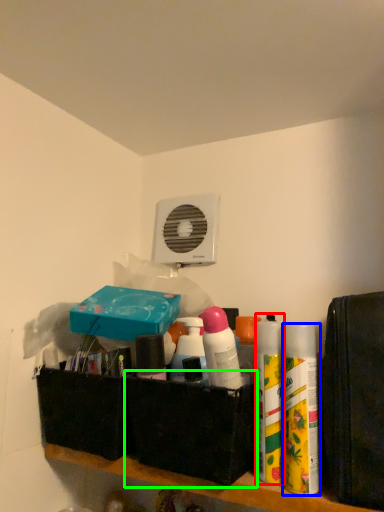
Question: Which object is positioned farthest from cleaning product (highlighted by a red box)? Select from cleaning product (highlighted by a blue box) and box (highlighted by a green box).

Choices:
 (A) cleaning product
 (B) box

Answer: (B)